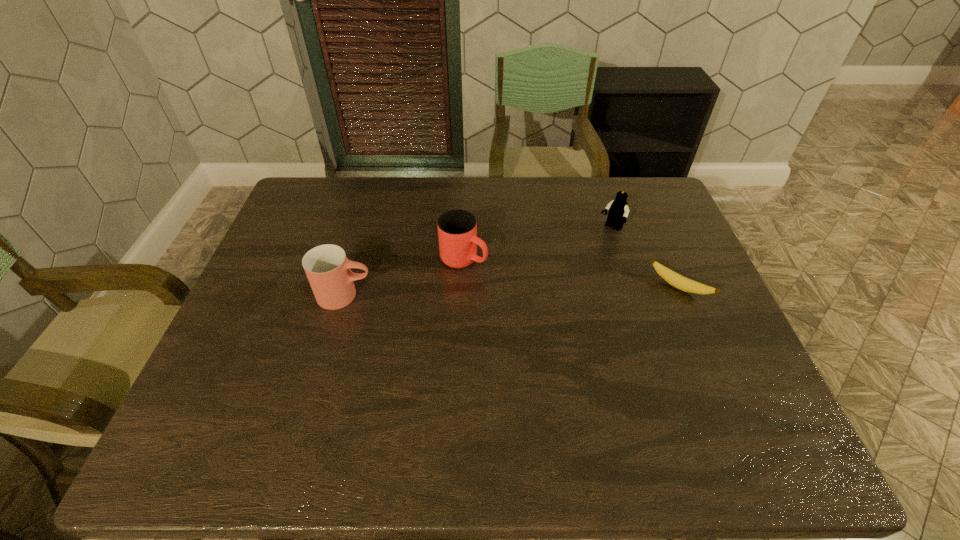
Identify which object is the third closest to the right cup. Please provide its 2D coordinates. Your answer should be formatted as a tuple, i.e. [(x, y)], where the tuple contains the x and y coordinates of a point satisfying the conditions above.

[(685, 284)]